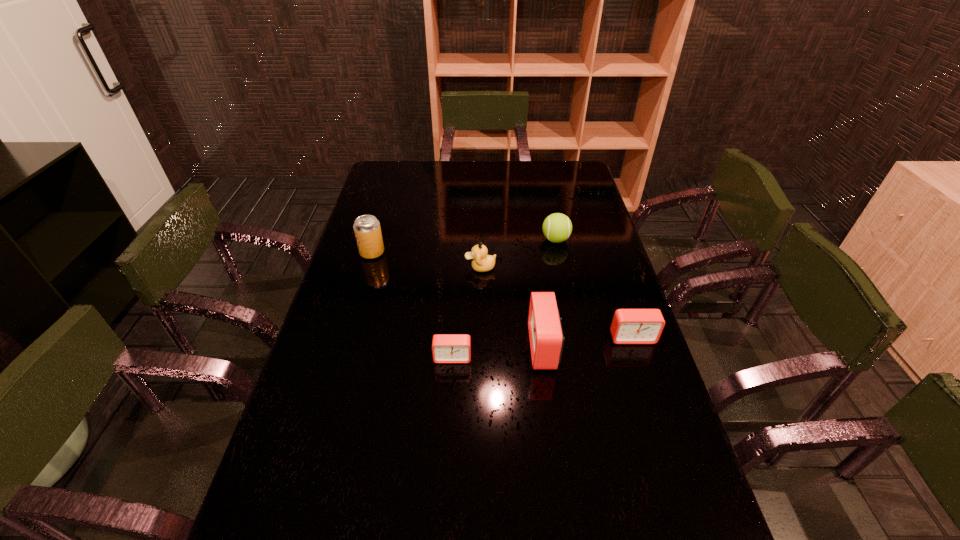
Find the location of `the shortest alarm clock`. the shortest alarm clock is located at coordinates click(446, 348).

Identify the location of the shortest object. The image size is (960, 540). (446, 348).

Find the location of a particular element. This screenshot has width=960, height=540. the second alarm clock from left to right is located at coordinates (546, 338).

The height and width of the screenshot is (540, 960). I want to click on the tallest alarm clock, so click(546, 338).

Where is `the rightmost alarm clock`? The height and width of the screenshot is (540, 960). the rightmost alarm clock is located at coordinates (629, 326).

Locate an element on the screen. The width and height of the screenshot is (960, 540). the rightmost object is located at coordinates (629, 326).

You are a GUI agent. You are given a task and a screenshot of the screen. Output one action in this format:
    pyautogui.click(x=<x>, y=<y>)
    Task: Click on the tennis ball
    The image size is (960, 540).
    Given the screenshot: What is the action you would take?
    pyautogui.click(x=557, y=227)

At what (x,y) coordinates should I click in order to perform the action: click on duckling. Please return your answer as a coordinate pair (x, y). Looking at the image, I should click on (481, 262).

What are the coordinates of `pop (soda)` in the screenshot? It's located at click(x=367, y=230).

You are a GUI agent. You are given a task and a screenshot of the screen. Output one action in this format:
    pyautogui.click(x=<x>, y=<y>)
    Task: Click on the free space located on the front-facing side of the leftmost alarm clock
    
    Given the screenshot: What is the action you would take?
    pyautogui.click(x=451, y=380)